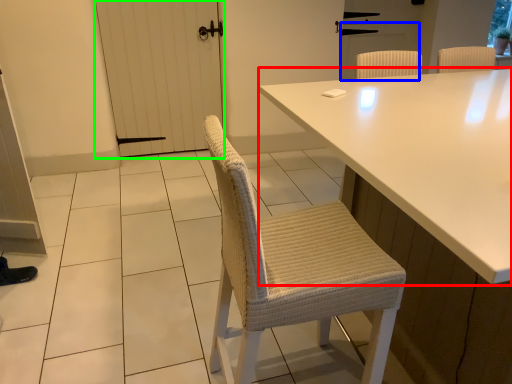
Question: Which object is positioned farthest from table (highlighted by a red box)? Select from screen door (highlighted by a blue box) and screen door (highlighted by a green box).

Choices:
 (A) screen door
 (B) screen door

Answer: (A)